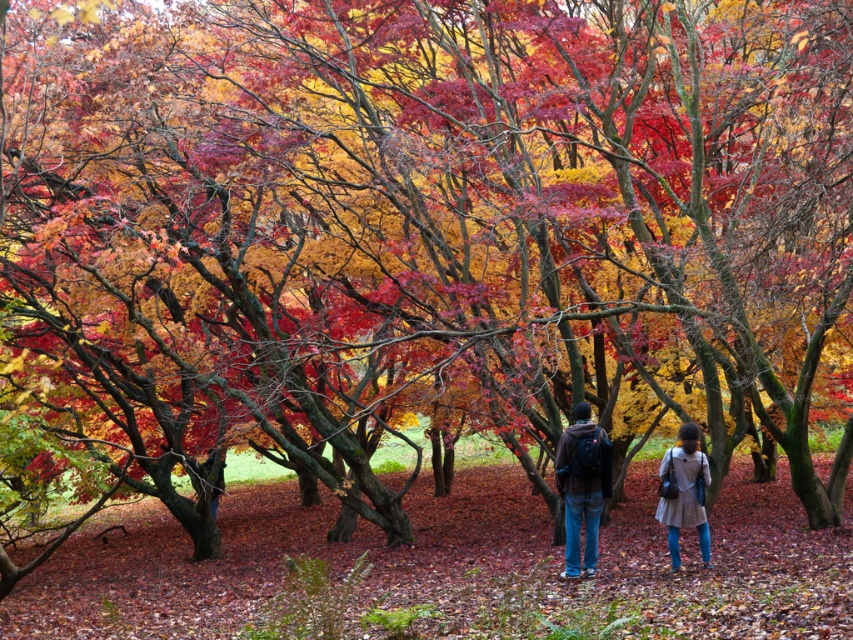
From the picture: Between matte brown jacket at center and light brown fabric coat at lower right, which one has more height?

Standing taller between the two is matte brown jacket at center.

Is matte brown jacket at center above light brown fabric coat at lower right?

Yes, matte brown jacket at center is above light brown fabric coat at lower right.

Which is in front, point (595, 572) or point (668, 541)?

Point (595, 572) is in front.

At what (x,y) coordinates should I click in order to perform the action: click on matte brown jacket at center. Please return your answer as a coordinate pair (x, y). Looking at the image, I should click on (582, 486).

Does brown leather jacket at center have a smaller size compared to light brown fabric coat at lower right?

Yes, brown leather jacket at center is smaller than light brown fabric coat at lower right.

Looking at this image, is brown leather jacket at center in front of light brown fabric coat at lower right?

That is False.

Is point (686, 456) less distant than point (666, 524)?

Yes.

At what (x,y) coordinates should I click in order to perform the action: click on brown leather jacket at center. Please return your answer as a coordinate pair (x, y). Looking at the image, I should click on (686, 492).

The image size is (853, 640). What do you see at coordinates (686, 492) in the screenshot?
I see `brown leather jacket at center` at bounding box center [686, 492].

Measure the distance from brown leather jacket at center to matte brown jacket at center.

2.04 inches

Between point (692, 436) and point (579, 452), which one is positioned in front?

Point (692, 436)

The height and width of the screenshot is (640, 853). What are the coordinates of `brown leather jacket at center` in the screenshot? It's located at (686, 492).